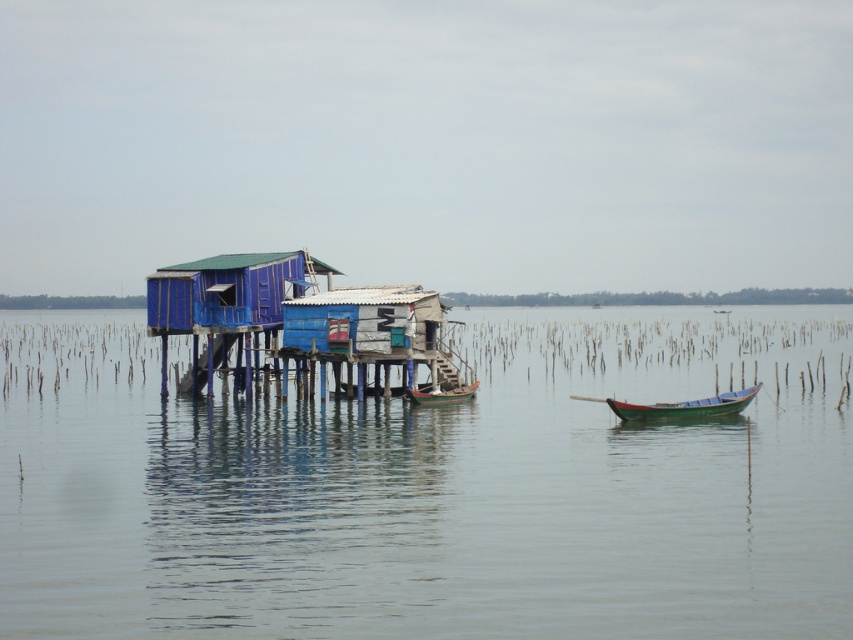
You are standing at the point marked as point (752, 388) in the image. You want to walk back to the viewer who is observing the waterfront scene. How far will you have to walk?

You will have to walk 38.76 meters to reach the viewer from point (752, 388) since they are 38.76 meters apart.

Based on the photo, you are standing at the point marked by the coordinates point (431,488). Looking towards the house on the left, what do you see in front of you?

The point (431,488) indicates clear water at house left, so you would see clear water in front of you when facing the house on the left.